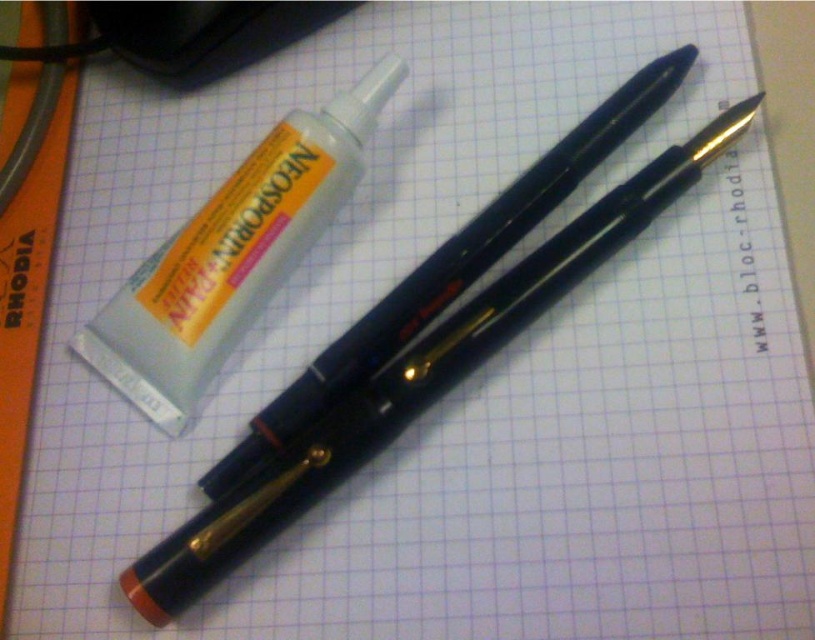
You are organizing your desk and want to place the white glossy tube at upper left and the black plastic pen at center into a drawer. The drawer has limited space. Based on the desk setup, which object will require more space in the drawer?

The black plastic pen at center requires more space in the drawer because the white glossy tube at upper left occupies less space than it.

From the picture: You are organizing a desk and need to place two items. The first item is at point (184, 420) and the second at point (545, 164). From the observer perspective, which point is closer to you?

Point (184, 420) is in front of point (545, 164), so it is closer to the observer.

You are an artist preparing to draw a detailed sketch. You have a white glossy tube at upper left and a black plastic pen at center on your desk. Which object is narrower in width?

The white glossy tube at upper left has a lesser width compared to the black plastic pen at center, so the white glossy tube at upper left is narrower.